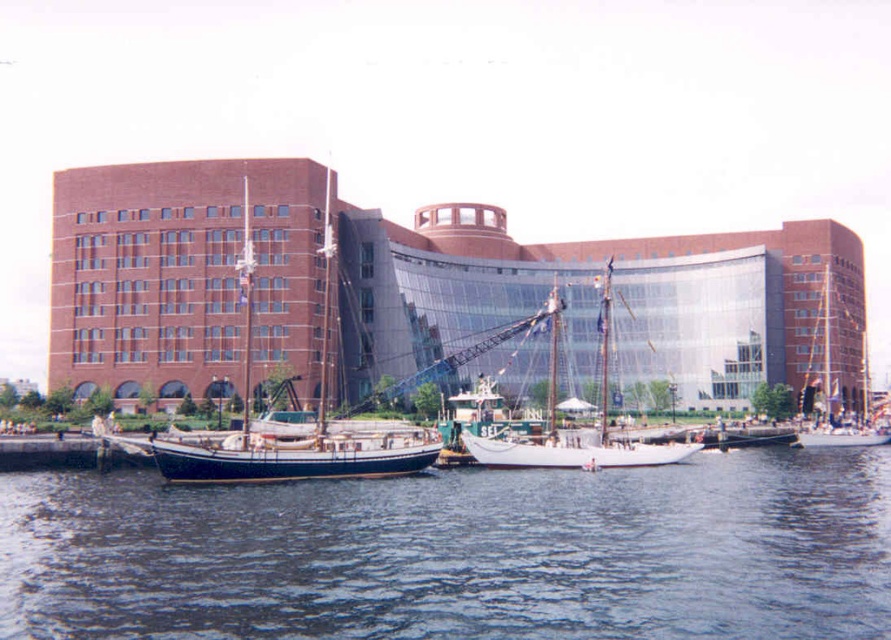
Question: Which point is farther to the camera?

Choices:
 (A) (759, 636)
 (B) (571, 448)

Answer: (B)

Question: Is dark blue polished wood sailboat at left to the left of white wooden sailboat at center from the viewer's perspective?

Choices:
 (A) no
 (B) yes

Answer: (B)

Question: Does blue water at center have a lesser width compared to dark blue polished wood sailboat at left?

Choices:
 (A) yes
 (B) no

Answer: (B)

Question: Estimate the real-world distances between objects in this image. Which object is closer to the white wooden sailboat at center?

Choices:
 (A) dark blue polished wood sailboat at left
 (B) blue water at center

Answer: (B)

Question: Among these objects, which one is farthest from the camera?

Choices:
 (A) dark blue polished wood sailboat at left
 (B) white wooden sailboat at center

Answer: (B)

Question: Can you confirm if dark blue polished wood sailboat at left is smaller than white wooden sailboat at center?

Choices:
 (A) yes
 (B) no

Answer: (A)